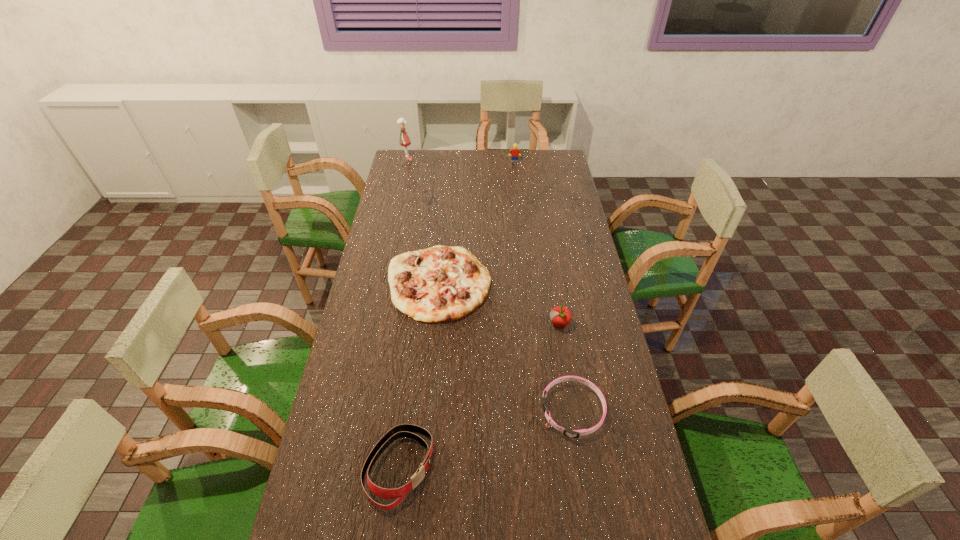
Where is `the tallest object`? This screenshot has height=540, width=960. the tallest object is located at coordinates (404, 140).

Locate an element on the screen. The width and height of the screenshot is (960, 540). Lego is located at coordinates (515, 152).

Identify the location of apple. The image size is (960, 540). (561, 316).

Locate an element on the screen. the taller dog collar is located at coordinates (400, 431).

I want to click on the left dog collar, so click(400, 431).

Find the location of a particular element. the right dog collar is located at coordinates (569, 433).

Identify the location of pizza. (441, 283).

Find the location of a particular element. The width and height of the screenshot is (960, 540). free space located 0.220m on the front-facing side of the doll is located at coordinates (457, 159).

Where is `free space located 0.190m on the front-facing side of the Lego`? The width and height of the screenshot is (960, 540). free space located 0.190m on the front-facing side of the Lego is located at coordinates (516, 184).

I want to click on vacant space located on the front of the apple, so click(567, 378).